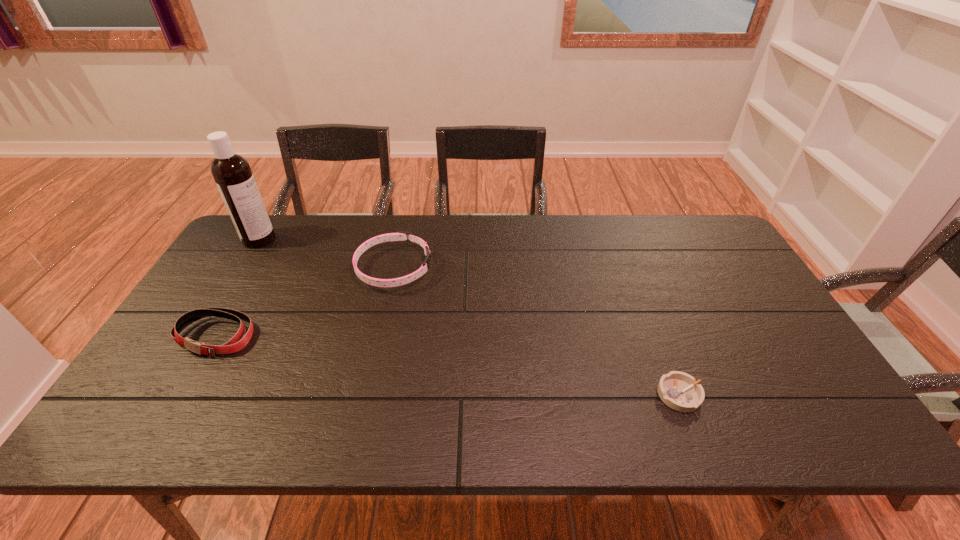
This screenshot has width=960, height=540. Find the location of `free space between the second object from right to left and the left dog collar`. free space between the second object from right to left and the left dog collar is located at coordinates (304, 302).

This screenshot has width=960, height=540. I want to click on free space between the farther dog collar and the shortest object, so click(x=537, y=332).

Identify which object is the closest to the dishwasher detergent. Please provide its 2D coordinates. Your answer should be formatted as a tuple, i.e. [(x, y)], where the tuple contains the x and y coordinates of a point satisfying the conditions above.

[(236, 343)]

The width and height of the screenshot is (960, 540). Identify the location of object that is the closest to the farther dog collar. (236, 343).

What are the coordinates of `free spot that satisfies the following two spatial constraints: 1. on the label side of the tallest object; 2. on the right side of the rightmost object` in the screenshot? It's located at (164, 395).

You are a GUI agent. You are given a task and a screenshot of the screen. Output one action in this format:
    pyautogui.click(x=<x>, y=<y>)
    Task: Click on the free space that satisfies the following two spatial constraints: 1. on the label side of the second nearest object; 2. on the right side of the tallest object
    This screenshot has height=540, width=960.
    Given the screenshot: What is the action you would take?
    pyautogui.click(x=200, y=336)

The image size is (960, 540). I want to click on free space that satisfies the following two spatial constraints: 1. on the label side of the tallest object; 2. on the right side of the nearest object, so click(x=164, y=395).

Identify the location of free spot that satisfies the following two spatial constraints: 1. on the label side of the dishwasher detergent; 2. on the left side of the left dog collar. The image size is (960, 540). (200, 336).

Where is `vacant position in the image that satisfies the following two spatial constraints: 1. on the label side of the dishwasher detergent; 2. on the right side of the second nearest object`? The width and height of the screenshot is (960, 540). vacant position in the image that satisfies the following two spatial constraints: 1. on the label side of the dishwasher detergent; 2. on the right side of the second nearest object is located at coordinates (200, 336).

Locate an element on the screen. The width and height of the screenshot is (960, 540). vacant position in the image that satisfies the following two spatial constraints: 1. with the buckle on the rightmost object; 2. on the left side of the right dog collar is located at coordinates (366, 395).